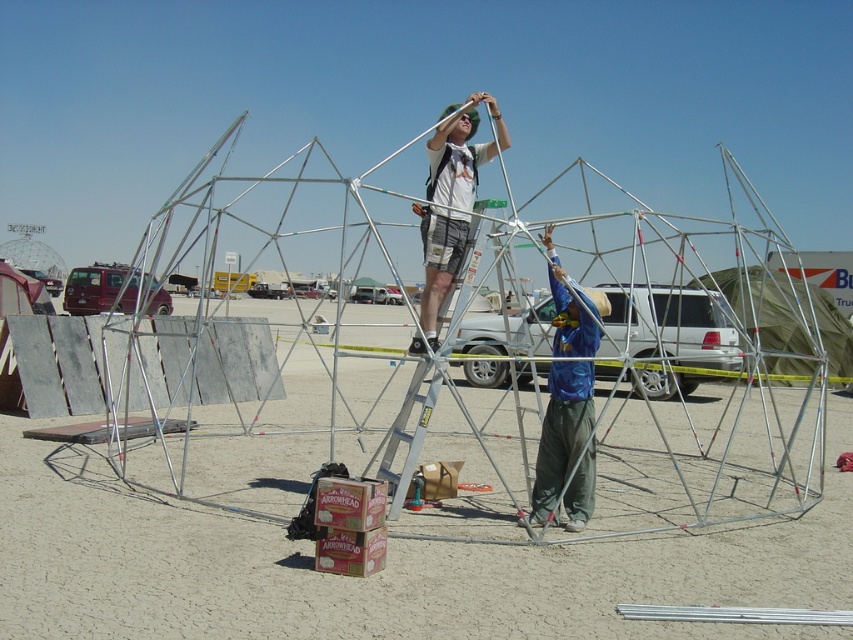
Is blue fabric shirt at center shorter than green fabric tent at center?

Correct, blue fabric shirt at center is not as tall as green fabric tent at center.

Does blue fabric shirt at center appear over green fabric tent at center?

No.

Is point (579, 365) farther from camera compared to point (764, 330)?

No, (579, 365) is closer to viewer.

Identify the location of blue fabric shirt at center. Image resolution: width=853 pixels, height=640 pixels. (566, 445).

Between green fabric tent at center and silver metallic ladder at center, which one appears on the left side from the viewer's perspective?

From the viewer's perspective, silver metallic ladder at center appears more on the left side.

Is green fabric tent at center to the left of silver metallic ladder at center from the viewer's perspective?

In fact, green fabric tent at center is to the right of silver metallic ladder at center.

Locate an element on the screen. The height and width of the screenshot is (640, 853). green fabric tent at center is located at coordinates (784, 314).

Between blue fabric shirt at center and silver metallic ladder at center, which one is positioned higher?

blue fabric shirt at center is above.

What do you see at coordinates (566, 445) in the screenshot? I see `blue fabric shirt at center` at bounding box center [566, 445].

This screenshot has width=853, height=640. I want to click on blue fabric shirt at center, so point(566,445).